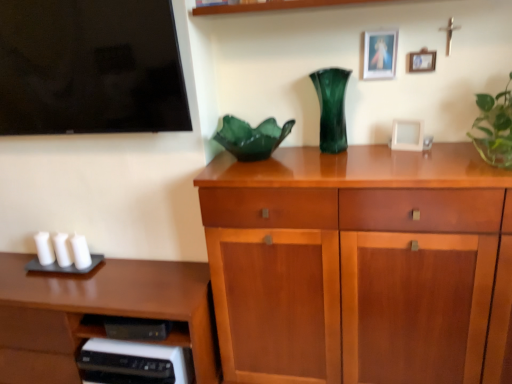
Locate an element on the screen. The height and width of the screenshot is (384, 512). free space between green glass vase at center and white matte picture frame at upper right, which is counted as the third picture frame, starting from the top is located at coordinates (373, 145).